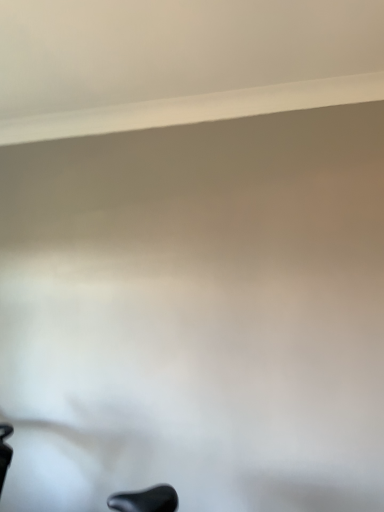
Question: Is black matte swivel chair at lower left wider than white smooth window sill at upper center?

Choices:
 (A) no
 (B) yes

Answer: (B)

Question: Is black matte swivel chair at lower left positioned behind white smooth window sill at upper center?

Choices:
 (A) no
 (B) yes

Answer: (A)

Question: Does black matte swivel chair at lower left have a lesser height compared to white smooth window sill at upper center?

Choices:
 (A) yes
 (B) no

Answer: (B)

Question: Can you confirm if black matte swivel chair at lower left is thinner than white smooth window sill at upper center?

Choices:
 (A) yes
 (B) no

Answer: (B)

Question: Could you tell me if black matte swivel chair at lower left is facing white smooth window sill at upper center?

Choices:
 (A) yes
 (B) no

Answer: (B)

Question: From a real-world perspective, is black matte swivel chair at lower left physically above white smooth window sill at upper center?

Choices:
 (A) no
 (B) yes

Answer: (A)

Question: Can you see white smooth window sill at upper center touching black matte swivel chair at lower left?

Choices:
 (A) yes
 (B) no

Answer: (B)

Question: Considering the relative positions of white smooth window sill at upper center and black matte swivel chair at lower left in the image provided, is white smooth window sill at upper center to the right of black matte swivel chair at lower left from the viewer's perspective?

Choices:
 (A) yes
 (B) no

Answer: (A)

Question: Is white smooth window sill at upper center at the left side of black matte swivel chair at lower left?

Choices:
 (A) yes
 (B) no

Answer: (B)

Question: From the image's perspective, is white smooth window sill at upper center on top of black matte swivel chair at lower left?

Choices:
 (A) no
 (B) yes

Answer: (B)

Question: Is white smooth window sill at upper center further to camera compared to black matte swivel chair at lower left?

Choices:
 (A) yes
 (B) no

Answer: (A)

Question: From the image's perspective, is white smooth window sill at upper center located beneath black matte swivel chair at lower left?

Choices:
 (A) no
 (B) yes

Answer: (A)

Question: Is white smooth window sill at upper center situated inside black matte swivel chair at lower left or outside?

Choices:
 (A) outside
 (B) inside

Answer: (A)